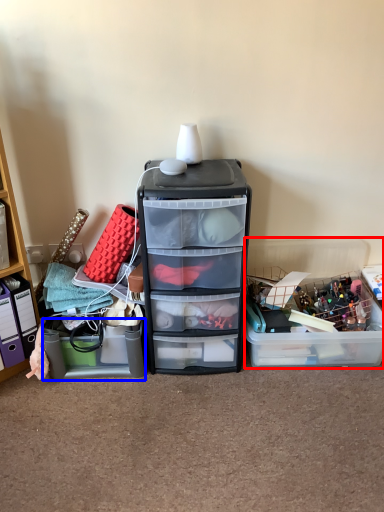
Question: Which of the following is the farthest to the observer, storage box (highlighted by a red box) or storage box (highlighted by a blue box)?

Choices:
 (A) storage box
 (B) storage box

Answer: (A)